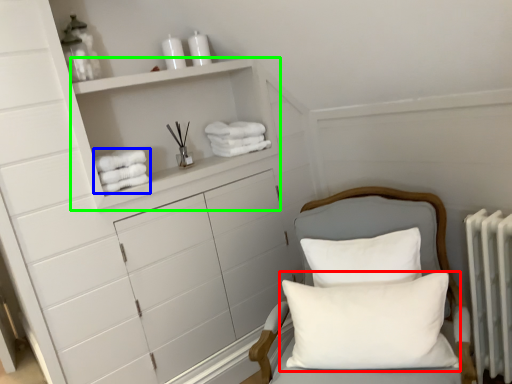
Question: Estimate the real-world distances between objects in this image. Which object is closer to pillow (highlighted by a red box), bath towel (highlighted by a blue box) or cabinet (highlighted by a green box)?

Choices:
 (A) bath towel
 (B) cabinet

Answer: (B)